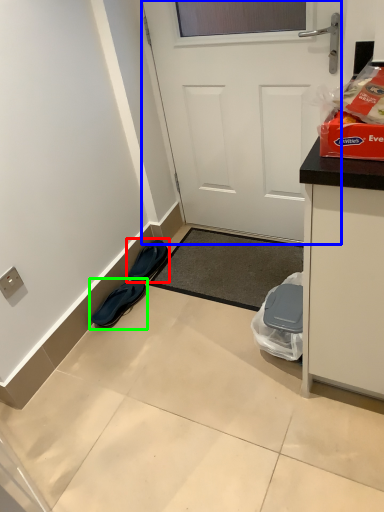
Question: Which is farther away from footwear (highlighted by a red box)? door (highlighted by a blue box) or footwear (highlighted by a green box)?

Choices:
 (A) door
 (B) footwear

Answer: (A)